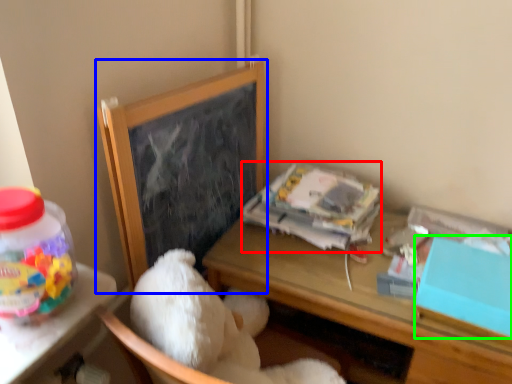
Question: Which is nearer to the paperback book (highlighted by a red box)? bulletin board (highlighted by a blue box) or box (highlighted by a green box).

Choices:
 (A) bulletin board
 (B) box

Answer: (A)